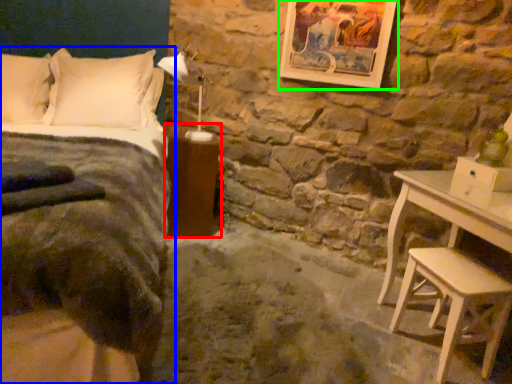
Question: Estimate the real-world distances between objects in this image. Which object is farther from nightstand (highlighted by a red box), bed (highlighted by a blue box) or picture frame (highlighted by a green box)?

Choices:
 (A) bed
 (B) picture frame

Answer: (B)